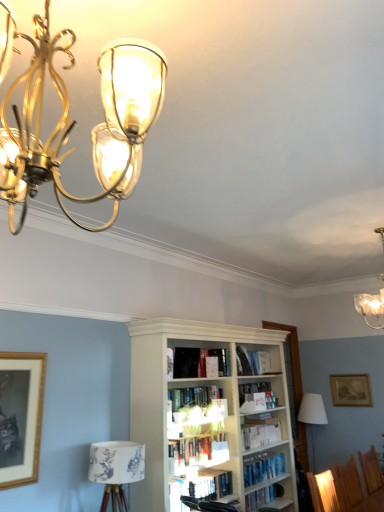
Question: From a real-world perspective, is hardcover books at center, arranged as the 3th book when viewed from the top, under translucent glass chandelier at upper right, placed as the first lamp when sorted from back to front?

Choices:
 (A) yes
 (B) no

Answer: (A)

Question: From the image's perspective, is hardcover books at center, arranged as the 3th book when viewed from the top, under translucent glass chandelier at upper right, placed as the first lamp when sorted from back to front?

Choices:
 (A) no
 (B) yes

Answer: (B)

Question: Considering the relative sizes of hardcover books at center, which is the third book from bottom to top, and translucent glass chandelier at upper right, acting as the 2th lamp starting from the front, in the image provided, is hardcover books at center, which is the third book from bottom to top, shorter than translucent glass chandelier at upper right, acting as the 2th lamp starting from the front,?

Choices:
 (A) no
 (B) yes

Answer: (B)

Question: Is hardcover books at center, which is the third book from bottom to top, outside of translucent glass chandelier at upper right, placed as the first lamp when sorted from back to front?

Choices:
 (A) yes
 (B) no

Answer: (A)

Question: Is hardcover books at center, which is the third book from bottom to top, closer to the viewer compared to translucent glass chandelier at upper right, marked as the second lamp in a left-to-right arrangement?

Choices:
 (A) no
 (B) yes

Answer: (B)

Question: Based on their positions, is black leather swivel chair at center located to the left or right of hardcover book at center, placed as the 1th book when sorted from top to bottom?

Choices:
 (A) left
 (B) right

Answer: (A)

Question: Looking at their shapes, would you say black leather swivel chair at center is wider or thinner than hardcover book at center, placed as the 1th book when sorted from top to bottom?

Choices:
 (A) thin
 (B) wide

Answer: (B)

Question: From the image's perspective, relative to hardcover book at center, placed as the 1th book when sorted from top to bottom, is black leather swivel chair at center above or below?

Choices:
 (A) below
 (B) above

Answer: (A)

Question: From their relative heights in the image, would you say black leather swivel chair at center is taller or shorter than hardcover book at center, the 5th book when ordered from bottom to top?

Choices:
 (A) tall
 (B) short

Answer: (B)

Question: Would you say white wooden bookshelf at lower center is to the left or to the right of hardcover book at center, placed as the first book when sorted from bottom to top, in the picture?

Choices:
 (A) right
 (B) left

Answer: (A)

Question: In terms of width, does white wooden bookshelf at lower center look wider or thinner when compared to hardcover book at center, acting as the fifth book starting from the top?

Choices:
 (A) wide
 (B) thin

Answer: (B)

Question: Is white wooden bookshelf at lower center inside or outside of hardcover book at center, acting as the fifth book starting from the top?

Choices:
 (A) outside
 (B) inside

Answer: (A)

Question: Is white wooden bookshelf at lower center in front of or behind hardcover book at center, acting as the fifth book starting from the top, in the image?

Choices:
 (A) front
 (B) behind

Answer: (B)

Question: Do you think wooden picture frame at upper right, the 2th picture frame from the left, is within wooden framed print at lower left, which is the 2th picture frame from back to front, or outside of it?

Choices:
 (A) inside
 (B) outside

Answer: (B)

Question: Looking at their shapes, would you say wooden picture frame at upper right, the 2th picture frame viewed from the top, is wider or thinner than wooden framed print at lower left, which appears as the second picture frame when ordered from the bottom?

Choices:
 (A) thin
 (B) wide

Answer: (B)